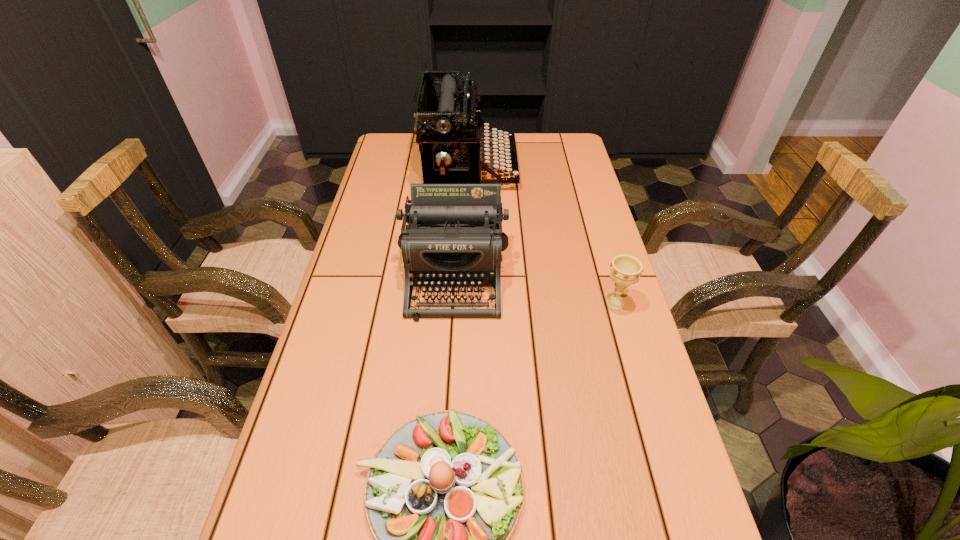
You are a GUI agent. You are given a task and a screenshot of the screen. Output one action in this format:
    pyautogui.click(x=<x>, y=<y>)
    Task: Click on the taller typewriter
    This screenshot has width=960, height=540.
    Given the screenshot: What is the action you would take?
    pyautogui.click(x=451, y=121)

Identify the location of the tallest object. This screenshot has height=540, width=960. (451, 121).

You are a GUI agent. You are given a task and a screenshot of the screen. Output one action in this format:
    pyautogui.click(x=<x>, y=<y>)
    Task: Click on the shorter typewriter
    This screenshot has width=960, height=540.
    Given the screenshot: What is the action you would take?
    pyautogui.click(x=454, y=237)

You are a GUI agent. You are given a task and a screenshot of the screen. Output one action in this format:
    pyautogui.click(x=<x>, y=<y>)
    Task: Click on the third shortest object
    The height and width of the screenshot is (540, 960).
    Given the screenshot: What is the action you would take?
    pyautogui.click(x=454, y=237)

Identify the location of chalice. The image size is (960, 540). (x=625, y=269).

The width and height of the screenshot is (960, 540). I want to click on the second shortest object, so click(625, 269).

Find the location of `vacant space located on the typing side of the taller typewriter`. vacant space located on the typing side of the taller typewriter is located at coordinates (556, 167).

Locate an element on the screen. vacant area situated 0.220m on the keyboard of the nearer typewriter is located at coordinates (447, 404).

Where is `vacant space situated on the left of the second shortest object`? This screenshot has width=960, height=540. vacant space situated on the left of the second shortest object is located at coordinates (446, 304).

Find the location of `object at the far edge`. object at the far edge is located at coordinates (451, 121).